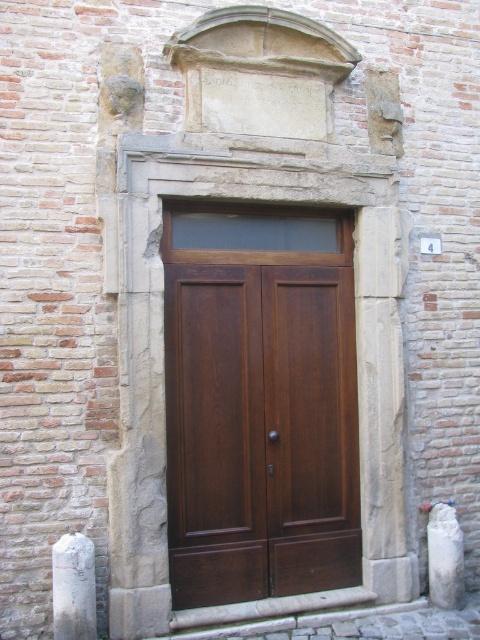
The height and width of the screenshot is (640, 480). What do you see at coordinates (73, 588) in the screenshot? I see `white stone pillar at lower left` at bounding box center [73, 588].

Can you confirm if white stone pillar at lower left is positioned to the left of white marble pillar at center?

Yes, white stone pillar at lower left is to the left of white marble pillar at center.

Is point (71, 536) positioned in front of point (430, 570)?

Yes, point (71, 536) is closer to viewer.

Locate an element on the screen. The height and width of the screenshot is (640, 480). white stone pillar at lower left is located at coordinates (73, 588).

Is the position of dark wood door at center less distant than that of white marble pillar at center?

That is True.

Can you confirm if dark wood door at center is positioned to the left of white marble pillar at center?

Correct, you'll find dark wood door at center to the left of white marble pillar at center.

Is point (245, 474) closer to camera compared to point (432, 595)?

Yes.

Locate an element on the screen. The width and height of the screenshot is (480, 640). dark wood door at center is located at coordinates (260, 403).

Can you confirm if dark wood door at center is thinner than white stone pillar at lower left?

No.

This screenshot has width=480, height=640. What do you see at coordinates (260, 403) in the screenshot?
I see `dark wood door at center` at bounding box center [260, 403].

Consider the image. Measure the distance between dark wood door at center and camera.

dark wood door at center and camera are 4.56 meters apart.

Locate an element on the screen. The image size is (480, 640). dark wood door at center is located at coordinates (260, 403).